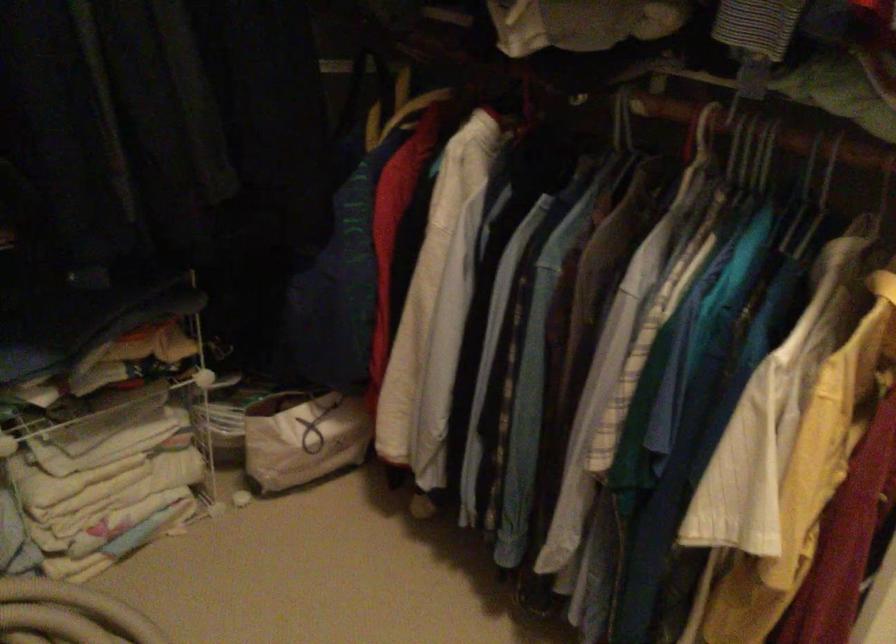
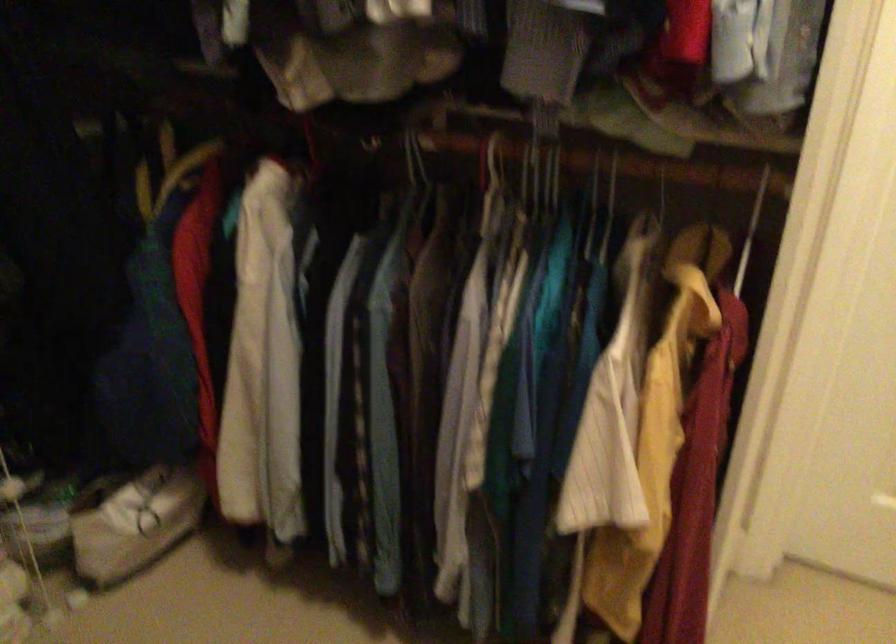
Question: The images are taken continuously from a first-person perspective. In which direction are you moving?

Choices:
 (A) Left
 (B) Right
 (C) Forward
 (D) Backward

Answer: (A)